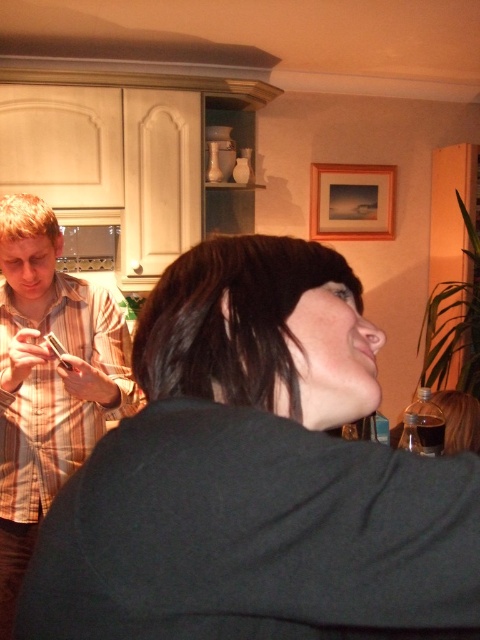
Who is lower down, dark gray sweater at center or wooden picture frame at upper right?

dark gray sweater at center is lower down.

Is point (317, 611) more distant than point (333, 234)?

No, (317, 611) is in front of (333, 234).

Is point (322, 568) farther from viewer compared to point (381, 168)?

That is False.

Where is `dark gray sweater at center`? This screenshot has width=480, height=640. dark gray sweater at center is located at coordinates pyautogui.click(x=255, y=476).

From the picture: Between dark gray sweater at center and plaid shirt at left, which one appears on the right side from the viewer's perspective?

Positioned to the right is dark gray sweater at center.

Is point (348, 579) closer to camera compared to point (19, 394)?

Yes.

Does point (127, 532) lie in front of point (22, 342)?

That is True.

You are a GUI agent. You are given a task and a screenshot of the screen. Output one action in this format:
    pyautogui.click(x=<x>, y=<y>)
    Task: Click on the dark gray sweater at center
    Image resolution: width=480 pixels, height=640 pixels.
    Given the screenshot: What is the action you would take?
    pyautogui.click(x=255, y=476)

Is plaid shirt at left bigger than wooden picture frame at upper right?

Correct, plaid shirt at left is larger in size than wooden picture frame at upper right.

Does plaid shirt at left appear over wooden picture frame at upper right?

Actually, plaid shirt at left is below wooden picture frame at upper right.

Where is `plaid shirt at left`? plaid shirt at left is located at coordinates (48, 380).

You are a GUI agent. You are given a task and a screenshot of the screen. Output one action in this format:
    pyautogui.click(x=<x>, y=<y>)
    Task: Click on the plaid shirt at left
    
    Given the screenshot: What is the action you would take?
    pyautogui.click(x=48, y=380)